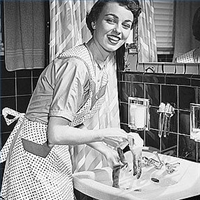
The image size is (200, 200). Identify the location of drainage hole in sink. (155, 180).